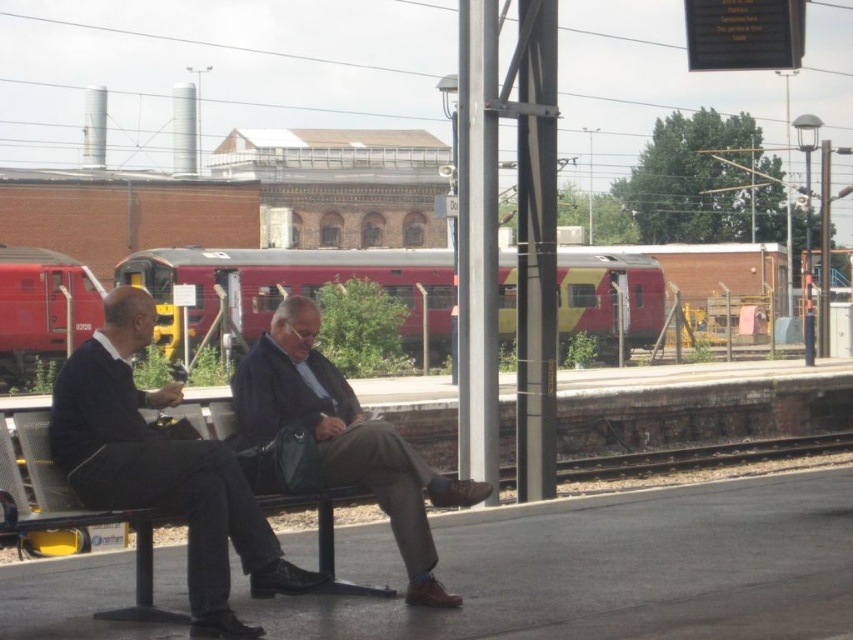
At what (x,y) coordinates should I click in order to perform the action: click on red/yellow painted train at center. Please return your answer as a coordinate pair (x, y). The height and width of the screenshot is (640, 853). Looking at the image, I should click on (288, 288).

Between red/yellow painted train at center and dark brown leather shoes at center, which one is positioned lower?

Positioned lower is dark brown leather shoes at center.

This screenshot has height=640, width=853. Describe the element at coordinates (288, 288) in the screenshot. I see `red/yellow painted train at center` at that location.

Locate an element on the screen. red/yellow painted train at center is located at coordinates 288,288.

Is dark blue suit at center positioned at the back of red matte train at left?

No, dark blue suit at center is in front of red matte train at left.

Who is more forward, (x=131, y=342) or (x=4, y=260)?

Point (x=131, y=342) is more forward.

This screenshot has height=640, width=853. I want to click on dark blue suit at center, so click(161, 468).

Is red/yellow painted train at center further to camera compared to red matte train at left?

That is False.

Which is behind, point (445, 269) or point (68, 266)?

Point (445, 269)

At what (x,y) coordinates should I click in order to perform the action: click on red/yellow painted train at center. Please return your answer as a coordinate pair (x, y). This screenshot has width=853, height=640. Looking at the image, I should click on (288, 288).